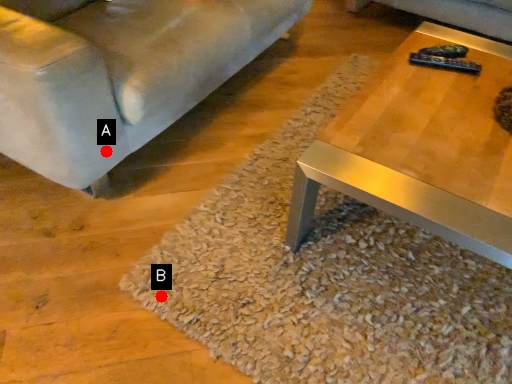
Question: Two points are circled on the image, labeled by A and B beside each circle. Which point appears closest to the camera in this image?

Choices:
 (A) A is closer
 (B) B is closer

Answer: (B)